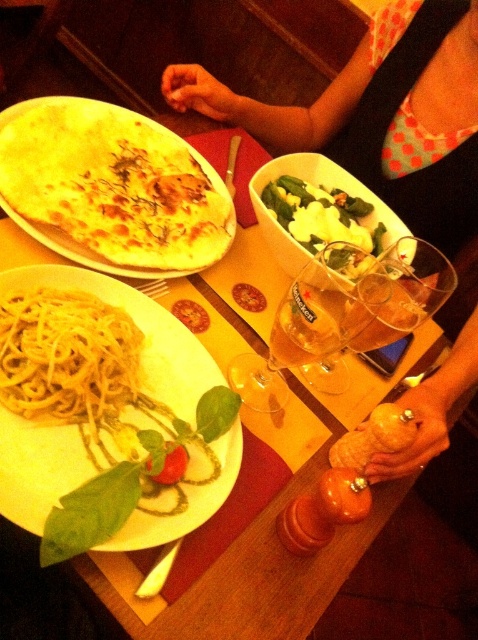
Question: Is golden crispy pizza at upper left bigger than green leafy salad at center?

Choices:
 (A) no
 (B) yes

Answer: (B)

Question: Does yellow matte pasta at center appear under yellow matte spaghetti at center?

Choices:
 (A) no
 (B) yes

Answer: (B)

Question: Which object is closer to the camera taking this photo?

Choices:
 (A) green leafy salad at center
 (B) yellow matte pasta at center
 (C) yellow matte spaghetti at center
 (D) golden crispy pizza at upper left

Answer: (B)

Question: Which object is the farthest from the golden crispy pizza at upper left?

Choices:
 (A) yellow matte spaghetti at center
 (B) yellow matte pasta at center

Answer: (A)

Question: Which point is closer to the camera taking this photo?

Choices:
 (A) (141, 488)
 (B) (394, 234)
 (C) (76, 314)

Answer: (A)

Question: Is yellow matte pasta at center behind golden crispy pizza at upper left?

Choices:
 (A) yes
 (B) no

Answer: (B)